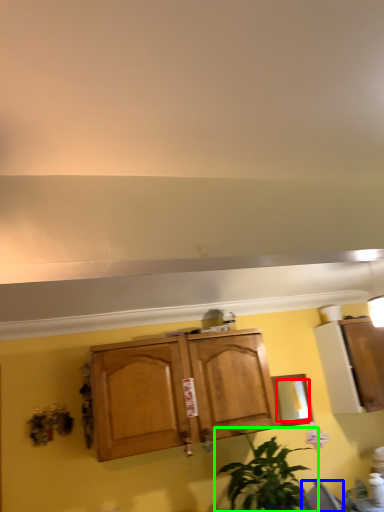
Question: Estimate the real-world distances between objects in this image. Which object is farther from mirror (highlighted by a red box), chair (highlighted by a blue box) or houseplant (highlighted by a green box)?

Choices:
 (A) chair
 (B) houseplant

Answer: (A)